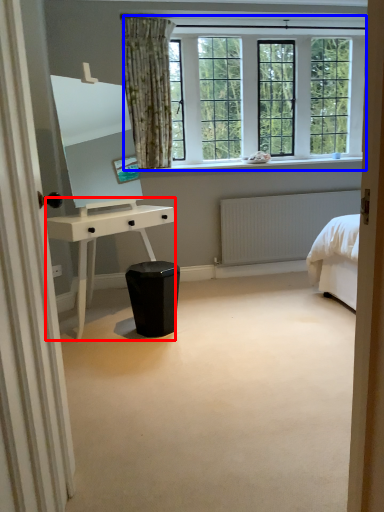
Question: Which of the following is the closest to the observer, desk (highlighted by a red box) or window (highlighted by a blue box)?

Choices:
 (A) desk
 (B) window

Answer: (A)